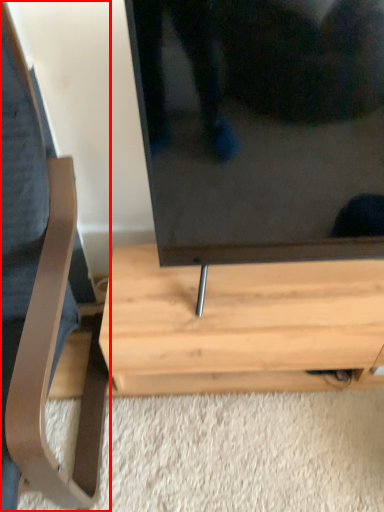
Question: Observing the image, what is the correct spatial positioning of furniture (annotated by the red box) in reference to table?

Choices:
 (A) left
 (B) right

Answer: (A)